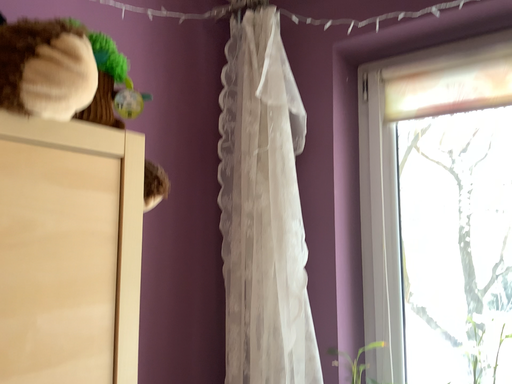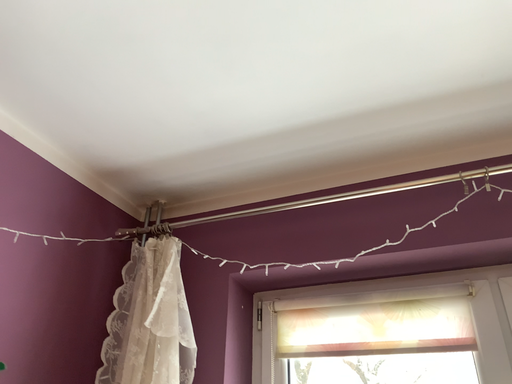
Question: How did the camera likely rotate when shooting the video?

Choices:
 (A) rotated left
 (B) rotated right

Answer: (B)